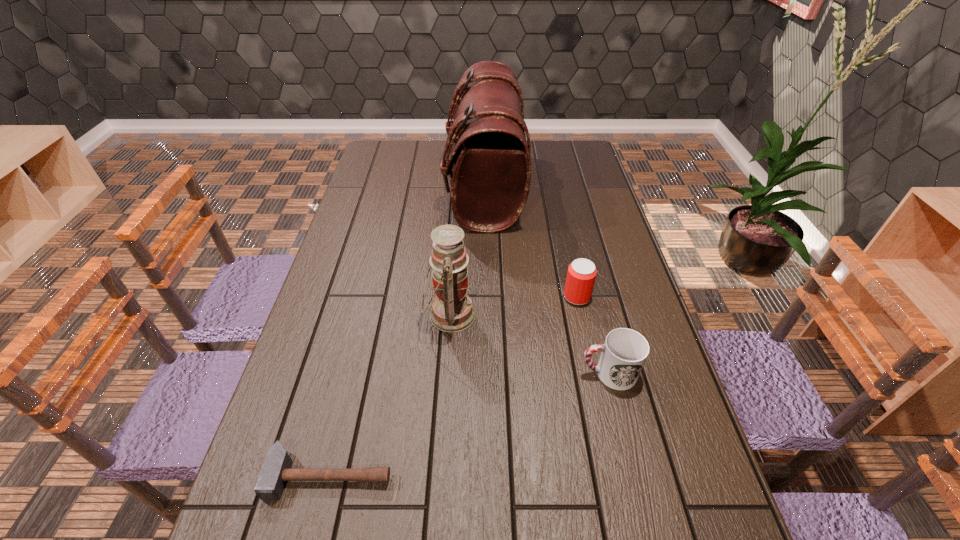
This screenshot has height=540, width=960. In the image, there is a desktop. Find the location of `free space at the left edge`. free space at the left edge is located at coordinates (321, 364).

At what (x,y) coordinates should I click in order to perform the action: click on vacant space at the right edge of the desktop. Please return your answer as a coordinate pair (x, y). The width and height of the screenshot is (960, 540). Looking at the image, I should click on (640, 329).

In the image, there is a desktop. Where is `vacant space at the far left corner`? The width and height of the screenshot is (960, 540). vacant space at the far left corner is located at coordinates (404, 154).

Image resolution: width=960 pixels, height=540 pixels. In order to click on vacant point located between the beer can and the oil lamp in this screenshot , I will do `click(514, 306)`.

At what (x,y) coordinates should I click in order to perform the action: click on vacant point located between the fourth farthest object and the farthest object. Please return your answer as a coordinate pair (x, y). The image size is (960, 540). Looking at the image, I should click on [546, 281].

Locate an element on the screen. The width and height of the screenshot is (960, 540). empty space between the second tallest object and the beer can is located at coordinates (514, 306).

Locate an element on the screen. unoccupied area between the shortest object and the oil lamp is located at coordinates (390, 395).

Identify the location of vacant space that's between the nearest object and the second nearest object. (469, 424).

Identify the location of free spot between the oil lamp and the second nearest object. (529, 344).

This screenshot has height=540, width=960. I want to click on vacant point located between the cup and the shortest object, so click(x=469, y=424).